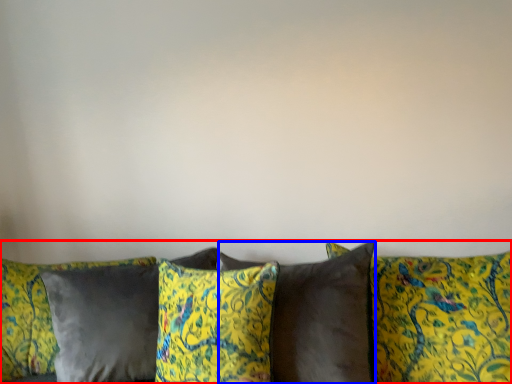
Question: Which of the following is the closest to the observer, studio couch (highlighted by a red box) or pillow (highlighted by a blue box)?

Choices:
 (A) studio couch
 (B) pillow

Answer: (A)